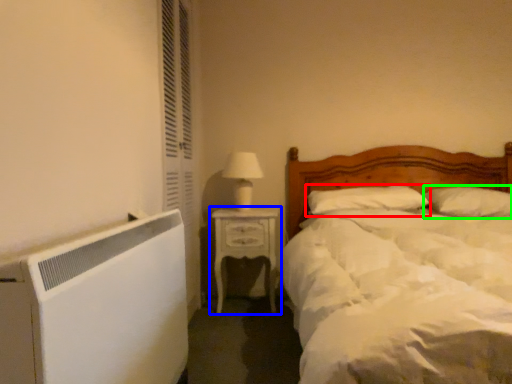
Question: Based on their relative distances, which object is farther from pillow (highlighted by a red box)? Choose from nightstand (highlighted by a blue box) and pillow (highlighted by a green box).

Choices:
 (A) nightstand
 (B) pillow

Answer: (A)